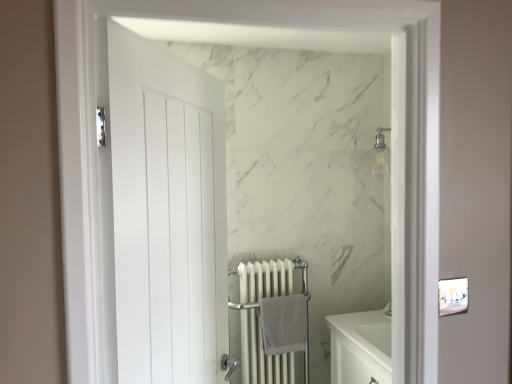
Question: In terms of height, does gray cotton bath towel at center look taller or shorter compared to white metal radiator at center?

Choices:
 (A) tall
 (B) short

Answer: (B)

Question: Visually, is gray cotton bath towel at center positioned to the left or to the right of white metal radiator at center?

Choices:
 (A) left
 (B) right

Answer: (B)

Question: Based on their relative distances, which object is nearer to the gray cotton bath towel at center?

Choices:
 (A) white matte door at left
 (B) white metal radiator at center

Answer: (B)

Question: Which of these objects is positioned farthest from the gray cotton bath towel at center?

Choices:
 (A) white matte door at left
 (B) white metal radiator at center

Answer: (A)